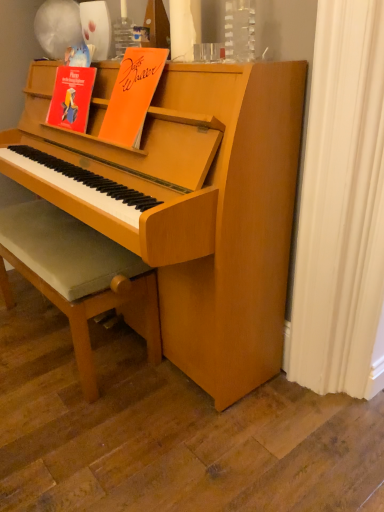
Question: Does orange matte paper at upper center have a lesser width compared to light brown wooden footrest at lower left?

Choices:
 (A) no
 (B) yes

Answer: (B)

Question: Considering the relative sizes of orange matte paper at upper center and light brown wooden footrest at lower left in the image provided, is orange matte paper at upper center shorter than light brown wooden footrest at lower left?

Choices:
 (A) no
 (B) yes

Answer: (B)

Question: Does orange matte paper at upper center touch light brown wooden footrest at lower left?

Choices:
 (A) yes
 (B) no

Answer: (B)

Question: Does orange matte paper at upper center have a greater width compared to light brown wooden footrest at lower left?

Choices:
 (A) yes
 (B) no

Answer: (B)

Question: Could you tell me if orange matte paper at upper center is turned towards light brown wooden footrest at lower left?

Choices:
 (A) no
 (B) yes

Answer: (A)

Question: Is orange matte paper at upper center oriented away from light brown wooden footrest at lower left?

Choices:
 (A) no
 (B) yes

Answer: (A)

Question: Considering the relative positions of light brown wooden footrest at lower left and orange matte paper at upper center in the image provided, is light brown wooden footrest at lower left to the left of orange matte paper at upper center from the viewer's perspective?

Choices:
 (A) yes
 (B) no

Answer: (A)

Question: Can you confirm if light brown wooden footrest at lower left is positioned to the right of orange matte paper at upper center?

Choices:
 (A) no
 (B) yes

Answer: (A)

Question: Is light brown wooden footrest at lower left looking in the opposite direction of orange matte paper at upper center?

Choices:
 (A) no
 (B) yes

Answer: (A)

Question: Does light brown wooden footrest at lower left have a greater height compared to orange matte paper at upper center?

Choices:
 (A) no
 (B) yes

Answer: (B)

Question: From a real-world perspective, is light brown wooden footrest at lower left beneath orange matte paper at upper center?

Choices:
 (A) no
 (B) yes

Answer: (B)

Question: Does light brown wooden footrest at lower left lie in front of orange matte paper at upper center?

Choices:
 (A) no
 (B) yes

Answer: (A)

Question: Looking at their shapes, would you say orange matte paper at upper center is wider or thinner than light brown wooden footrest at lower left?

Choices:
 (A) thin
 (B) wide

Answer: (A)